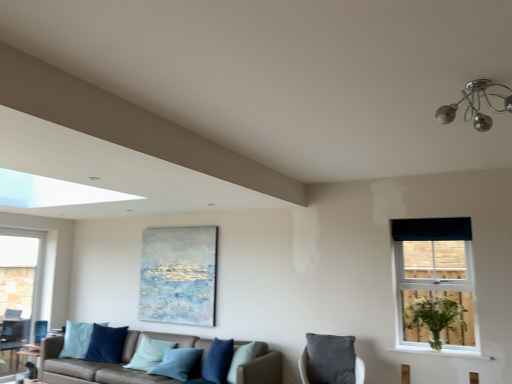
Question: Choose the correct answer: Is light blue fabric pillow at center, acting as the 3th pillow starting from the right, inside velvety gray pillow at lower center, which is the fourth pillow from left to right, or outside it?

Choices:
 (A) outside
 (B) inside

Answer: (A)

Question: In terms of width, does light blue fabric pillow at center, the third pillow positioned from the front, look wider or thinner when compared to velvety gray pillow at lower center, placed as the fourth pillow when sorted from back to front?

Choices:
 (A) wide
 (B) thin

Answer: (A)

Question: Estimate the real-world distances between objects in this image. Which object is closer to the green leafy plant at right?

Choices:
 (A) black fabric window at upper right, which is counted as the first window, starting from the right
 (B) textured canvas painting at center
 (C) velvet blue pillow at center, the third pillow viewed from the back
 (D) velvety gray pillow at lower center, placed as the 1th pillow when sorted from front to back
 (E) blue velvet pillow at lower left, positioned as the 1th pillow in left-to-right order

Answer: (A)

Question: Estimate the real-world distances between objects in this image. Which object is farther from the velvety gray pillow at lower center, placed as the 1th pillow when sorted from front to back?

Choices:
 (A) blue velvet pillow at lower left, the 1th pillow from the back
 (B) leather couch with blue pillows at lower center
 (C) green leafy plant at right
 (D) black fabric curtain at upper right
 (E) light blue fabric pillow at center, placed as the 2th pillow when sorted from left to right

Answer: (A)